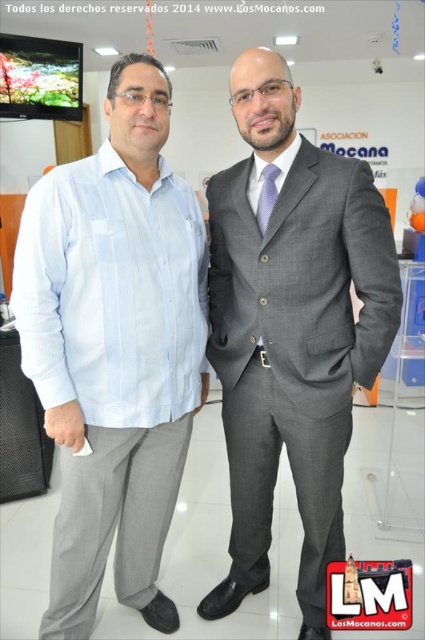
Who is shorter, gray wool suit at center or light blue silk tie at center?

light blue silk tie at center is shorter.

Which is more to the left, gray wool suit at center or light blue silk tie at center?

light blue silk tie at center

Who is more distant from viewer, (334, 476) or (275, 173)?

The point (334, 476) is behind.

Locate an element on the screen. Image resolution: width=425 pixels, height=640 pixels. gray wool suit at center is located at coordinates (291, 330).

Between point (184, 262) and point (278, 129), which one is positioned behind?

Positioned behind is point (184, 262).

Can you confirm if matte light blue shirt at left is positioned to the right of gray wool suit at center?

No, matte light blue shirt at left is not to the right of gray wool suit at center.

What do you see at coordinates (115, 348) in the screenshot? The width and height of the screenshot is (425, 640). I see `matte light blue shirt at left` at bounding box center [115, 348].

Where is `matte light blue shirt at left`? matte light blue shirt at left is located at coordinates (115, 348).

Does point (170, 442) come closer to viewer compared to point (271, 182)?

No, (170, 442) is further to viewer.

Describe the element at coordinates (115, 348) in the screenshot. I see `matte light blue shirt at left` at that location.

Where is `matte light blue shirt at left`? This screenshot has height=640, width=425. matte light blue shirt at left is located at coordinates (115, 348).